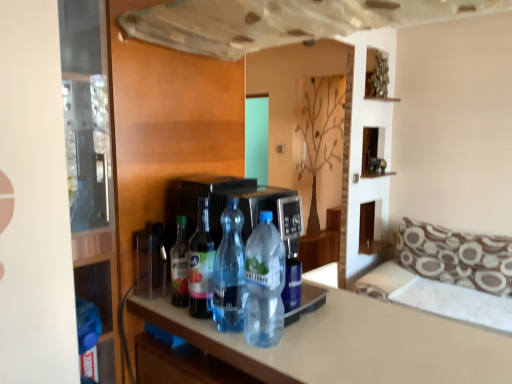
The image size is (512, 384). I want to click on vacant space to the left of transparent plastic bottle at center, which appears as the 3th bottle when viewed from the left, so click(185, 324).